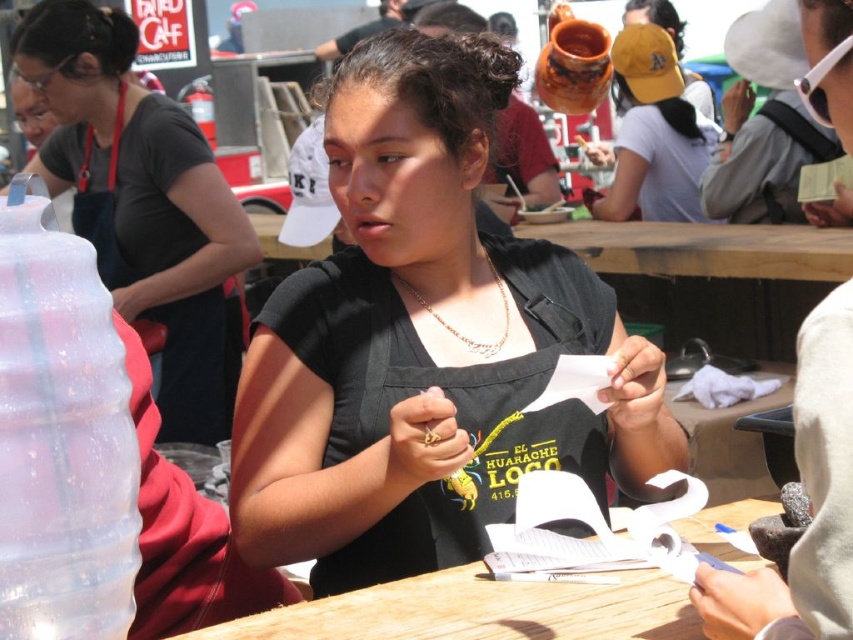
Can you confirm if matte black apron at center is thinner than matte yellow cap at upper center?

In fact, matte black apron at center might be wider than matte yellow cap at upper center.

Consider the image. Measure the distance from matte black apron at center to matte yellow cap at upper center.

8.78 feet

Does point (189, 205) lie behind point (689, 205)?

No, it is in front of (689, 205).

At what (x,y) coordinates should I click in order to perform the action: click on matte black apron at center. Please return your answer as a coordinate pair (x, y). This screenshot has width=853, height=640. Looking at the image, I should click on (140, 198).

Is matte black apron at center closer to the viewer compared to gold chain necklace at center?

No, it is not.

Does matte black apron at center appear on the right side of gold chain necklace at center?

In fact, matte black apron at center is to the left of gold chain necklace at center.

Which is behind, point (141, 214) or point (505, 314)?

Point (141, 214)

Identify the location of matte black apron at center. Image resolution: width=853 pixels, height=640 pixels. (140, 198).

Which is below, black matte shirt at center or matte black apron at center?

black matte shirt at center is below.

Between point (480, 413) and point (241, 220), which one is positioned in front?

Point (480, 413) is in front.

Who is more forward, (x=618, y=428) or (x=221, y=257)?

Point (x=618, y=428) is in front.

Find the location of a particular element. This screenshot has height=640, width=853. black matte shirt at center is located at coordinates (425, 342).